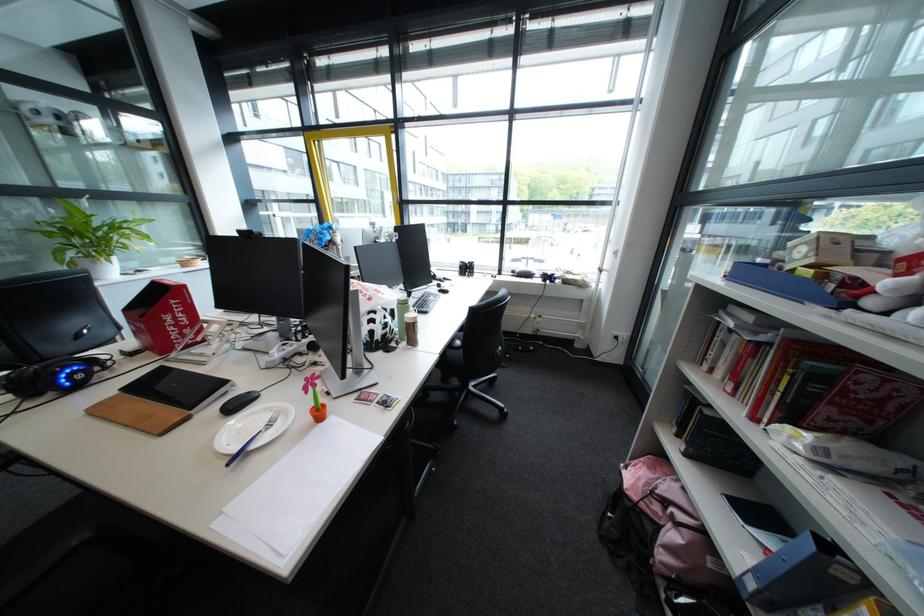
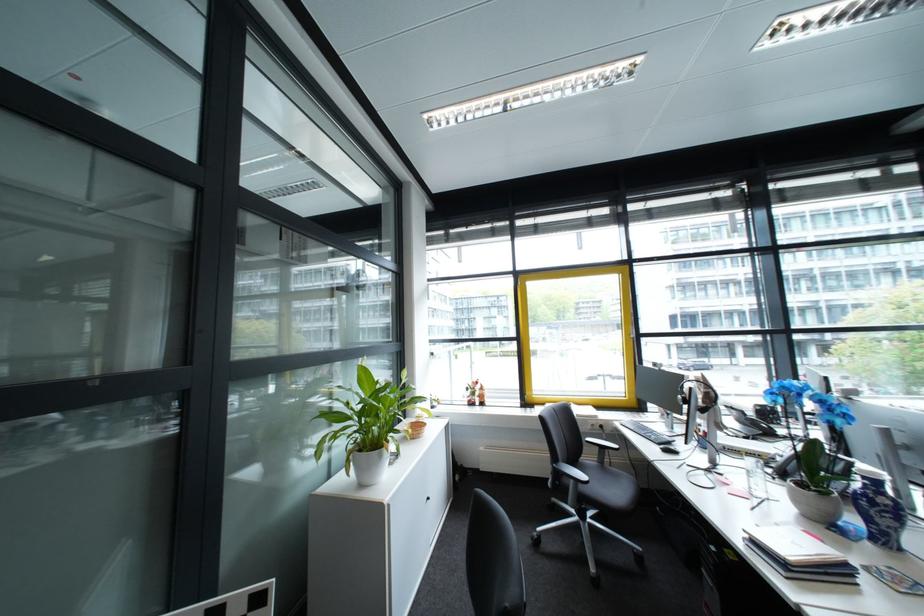
Question: What movement of the cameraman would produce the second image?

Choices:
 (A) Left
 (B) Right
 (C) Forward
 (D) Backward

Answer: (A)